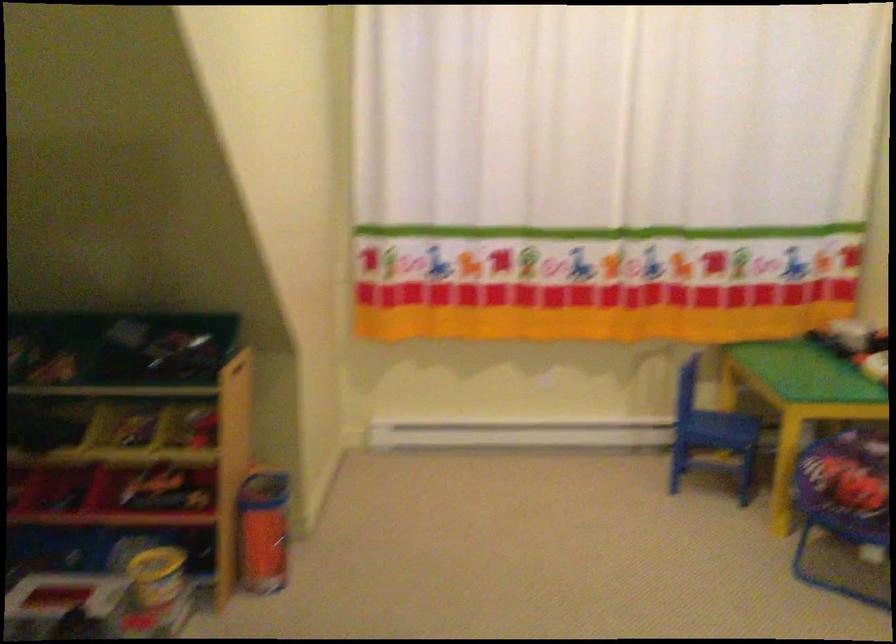
Find where to pull the yellow storage bin. Please return your answer as a coordinate pair (x, y).

(145, 457)